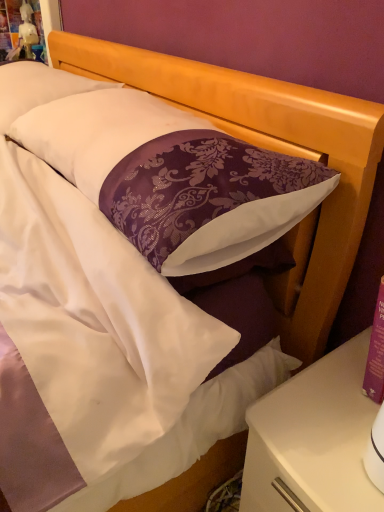
Question: From a real-world perspective, relative to white glossy nightstand at lower right, is purple damask pillow at center, the first pillow positioned from the front, vertically above or below?

Choices:
 (A) below
 (B) above

Answer: (B)

Question: Is purple damask pillow at center, arranged as the 2th pillow when viewed from the back, taller or shorter than white glossy nightstand at lower right?

Choices:
 (A) short
 (B) tall

Answer: (A)

Question: Considering the real-world distances, which object is farthest from the white satin pillow at upper left, positioned as the first pillow in back-to-front order?

Choices:
 (A) purple damask pillow at center, arranged as the 2th pillow when viewed from the back
 (B) white glossy nightstand at lower right

Answer: (B)

Question: Estimate the real-world distances between objects in this image. Which object is closer to the white glossy nightstand at lower right?

Choices:
 (A) purple damask pillow at center, the first pillow positioned from the front
 (B) white satin pillow at upper left, which appears as the second pillow when viewed from the front

Answer: (A)